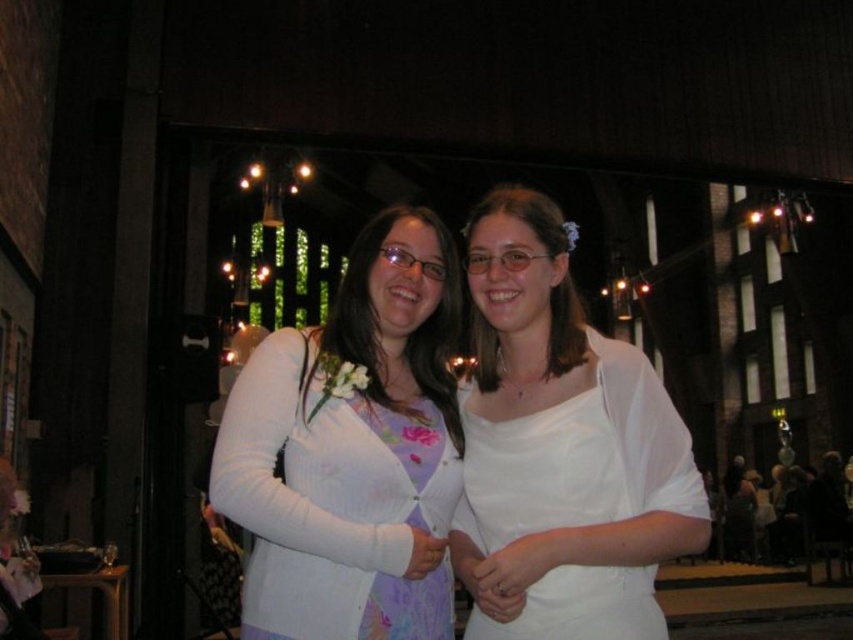
Consider the image. Which is more to the left, white matte cardigan at center or white satin dress at center?

white matte cardigan at center is more to the left.

Between white matte cardigan at center and white satin dress at center, which one is positioned higher?

white satin dress at center

Is point (253, 394) closer to camera compared to point (598, 552)?

No.

Identify the location of white matte cardigan at center. (352, 451).